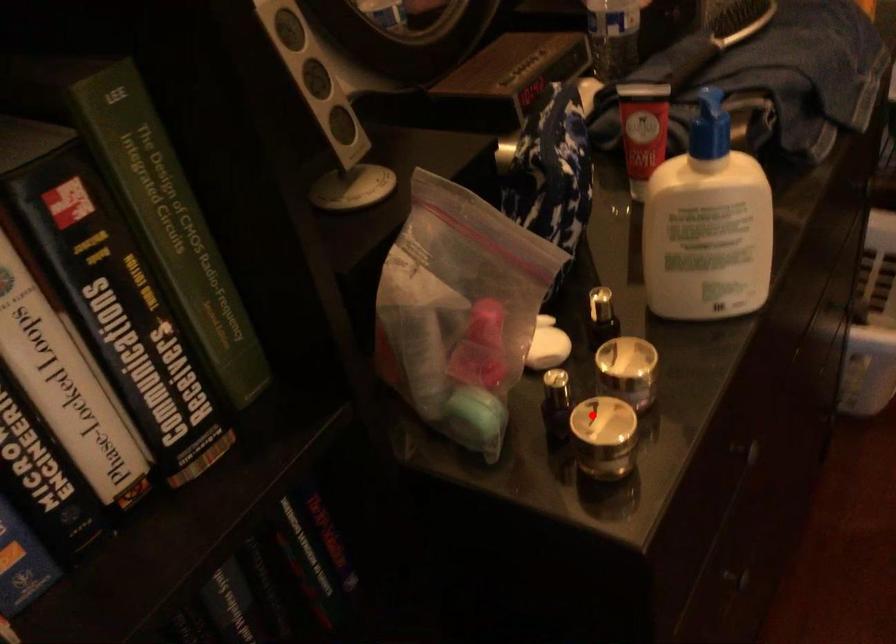
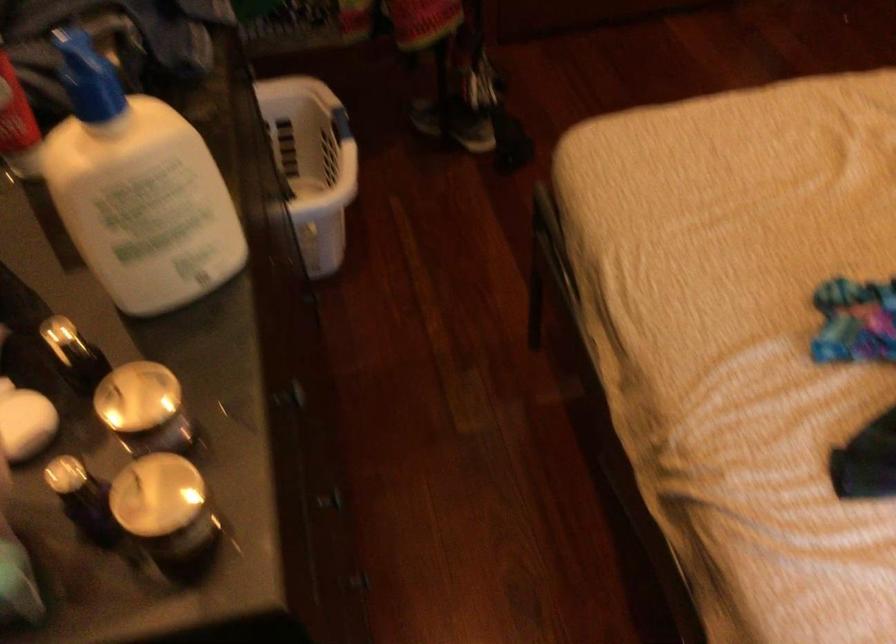
The point at the highlighted location is marked in the first image. Where is the corresponding point in the second image?

(157, 495)